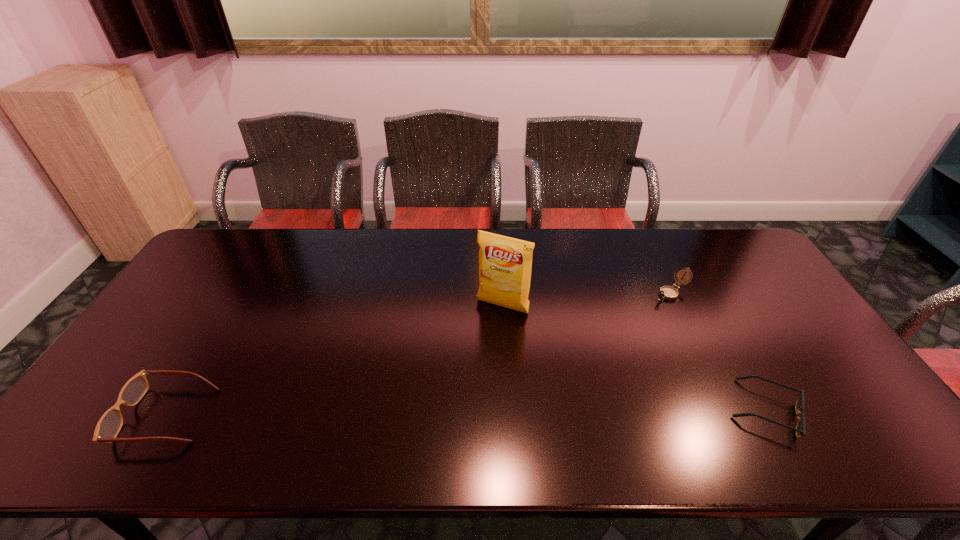
The image size is (960, 540). What are the coordinates of `vacant space located 0.060m on the front of the second object from left to right with the logo` in the screenshot? It's located at (486, 332).

You are a GUI agent. You are given a task and a screenshot of the screen. Output one action in this format:
    pyautogui.click(x=<x>, y=<y>)
    Task: Click on the vacant space located 0.060m on the front of the second object from left to right with the logo
    This screenshot has width=960, height=540.
    Given the screenshot: What is the action you would take?
    pyautogui.click(x=486, y=332)

This screenshot has height=540, width=960. I want to click on free region located on the face of the compass, so click(609, 334).

Image resolution: width=960 pixels, height=540 pixels. Find the location of `vacant space located on the face of the compass`. vacant space located on the face of the compass is located at coordinates (585, 351).

Identify the location of free region located 0.060m on the face of the compass. (647, 307).

You are a GUI agent. You are given a task and a screenshot of the screen. Output one action in this format:
    pyautogui.click(x=<x>, y=<y>)
    Task: Click on the spectacles located at the near edge
    The width and height of the screenshot is (960, 540).
    Given the screenshot: What is the action you would take?
    pyautogui.click(x=109, y=425)

At what (x,y) coordinates should I click in order to perform the action: click on sunglasses positioned at the near edge. Please return your answer as a coordinate pair (x, y). This screenshot has width=960, height=540. Looking at the image, I should click on (800, 429).

Where is `object present at the left edge`? The height and width of the screenshot is (540, 960). object present at the left edge is located at coordinates (109, 425).

Where is `object at the near left corner`? The width and height of the screenshot is (960, 540). object at the near left corner is located at coordinates (109, 425).

The image size is (960, 540). In order to click on vacant area at the far edge of the desktop in this screenshot , I will do `click(468, 255)`.